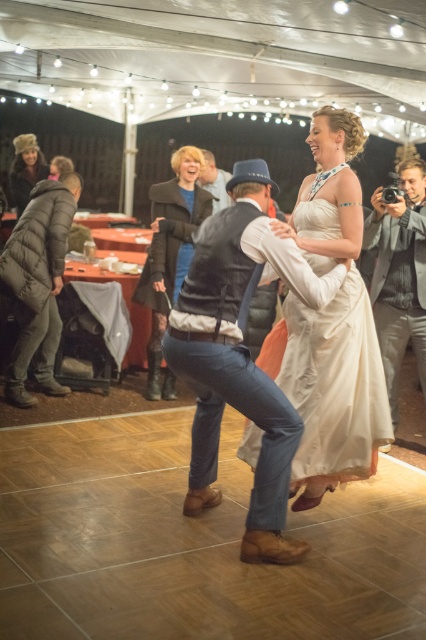
Question: Which point appears closest to the camera in this image?

Choices:
 (A) (213, 168)
 (B) (385, 248)

Answer: (B)

Question: Does denim jeans at center appear under silky white gown at center?

Choices:
 (A) no
 (B) yes

Answer: (B)

Question: Does denim jeans at center appear under dark brown leather jacket at upper center?

Choices:
 (A) no
 (B) yes

Answer: (B)

Question: Is dark gray puffer jacket at left wider than fuzzy brown hat at upper left?

Choices:
 (A) no
 (B) yes

Answer: (A)

Question: Which point appears farthest from the camera in this image?

Choices:
 (A) (224, 205)
 (B) (11, 355)
 (C) (250, 454)

Answer: (A)

Question: Among these points, which one is farthest from the camera?

Choices:
 (A) (273, 433)
 (B) (20, 211)
 (C) (25, 406)
 (D) (221, 204)

Answer: (B)